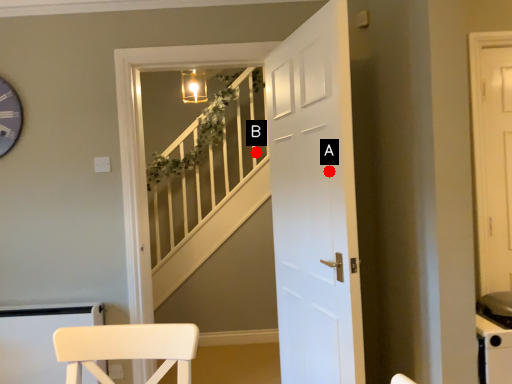
Question: Two points are circled on the image, labeled by A and B beside each circle. Which point is closer to the camera?

Choices:
 (A) A is closer
 (B) B is closer

Answer: (A)